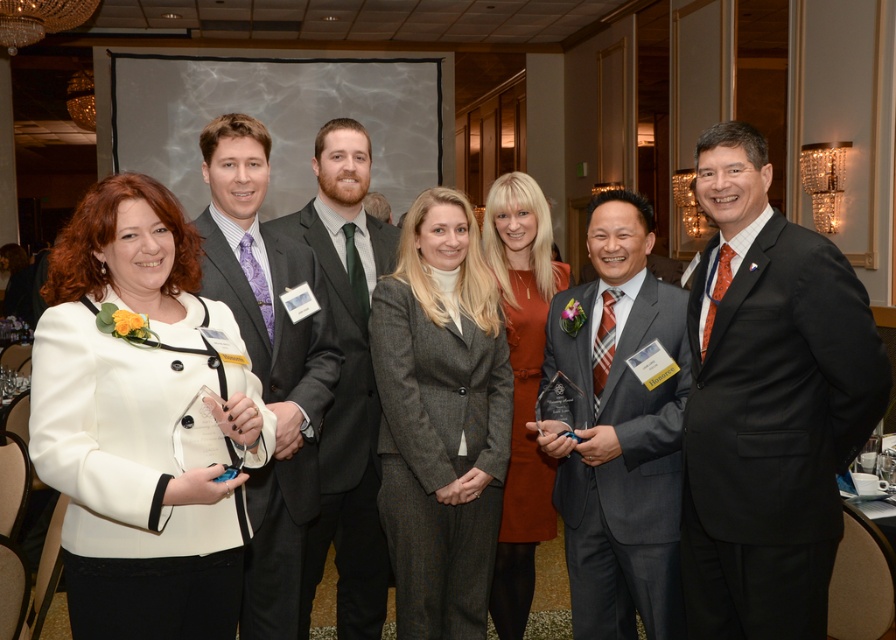
Question: Which object is the closest to the orange fabric dress at center?

Choices:
 (A) gray wool suit at center
 (B) white matte blazer at left
 (C) dark gray suit at center
 (D) matte purple tie at left

Answer: (A)

Question: Does gray wool suit at center appear on the left side of dark gray suit at center?

Choices:
 (A) no
 (B) yes

Answer: (A)

Question: Can you confirm if white matte blazer at left is smaller than matte purple tie at left?

Choices:
 (A) no
 (B) yes

Answer: (B)

Question: Which is farther from the orange fabric dress at center?

Choices:
 (A) matte purple tie at left
 (B) gray suit at center

Answer: (A)

Question: Which point is farther to the camera?

Choices:
 (A) (274, 563)
 (B) (87, 596)

Answer: (A)

Question: Is black suit at center wider than matte purple tie at left?

Choices:
 (A) no
 (B) yes

Answer: (B)